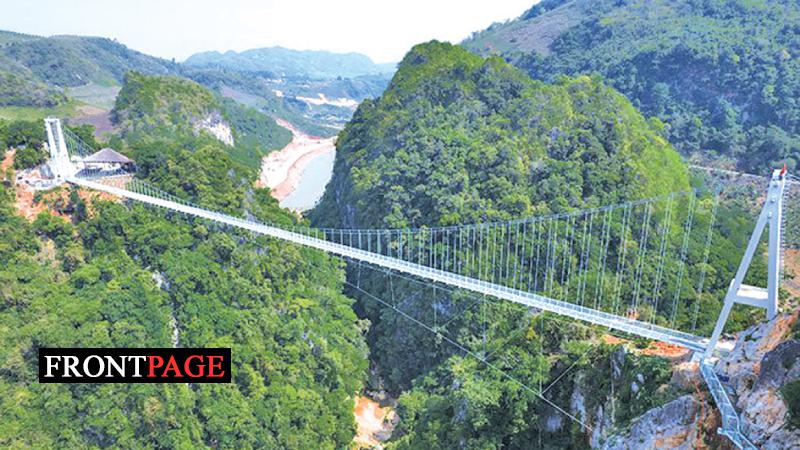
You are a GUI agent. You are given a task and a screenshot of the screen. Output one action in this format:
    pyautogui.click(x=<x>, y=<y>)
    Task: Click on the stairs
    This screenshot has height=450, width=800.
    Given the screenshot: What is the action you would take?
    pyautogui.click(x=732, y=408)